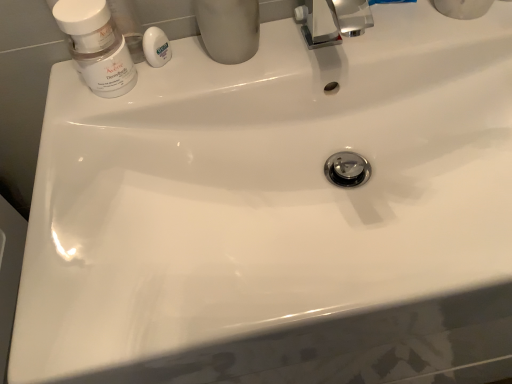
Identify the location of vacant area to the right of matte white jar at upper left. [x=226, y=69].